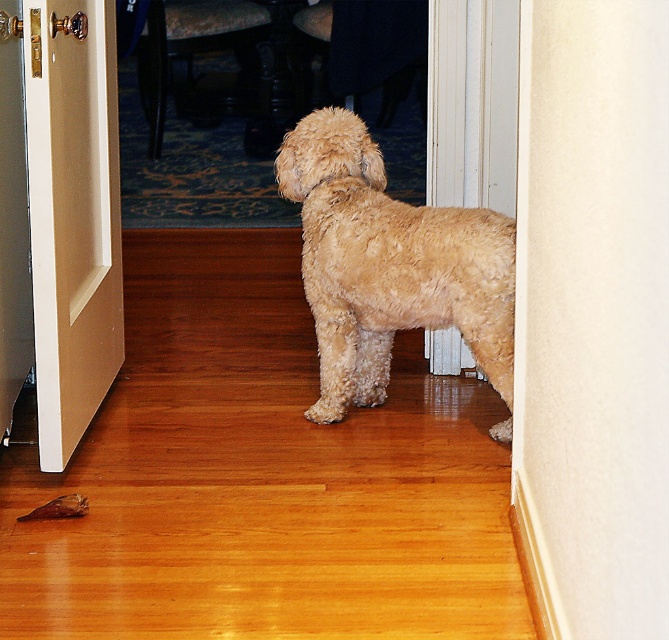
Question: Does fuzzy beige dog at center have a smaller size compared to beige wood door at left?

Choices:
 (A) yes
 (B) no

Answer: (B)

Question: Is fuzzy beige dog at center further to the viewer compared to beige wood door at left?

Choices:
 (A) no
 (B) yes

Answer: (B)

Question: Is fuzzy beige dog at center bigger than beige wood door at left?

Choices:
 (A) yes
 (B) no

Answer: (A)

Question: Which object appears closest to the camera in this image?

Choices:
 (A) beige wood door at left
 (B) fuzzy beige dog at center

Answer: (A)

Question: Which object is closer to the camera taking this photo?

Choices:
 (A) beige wood door at left
 (B) fuzzy beige dog at center

Answer: (A)